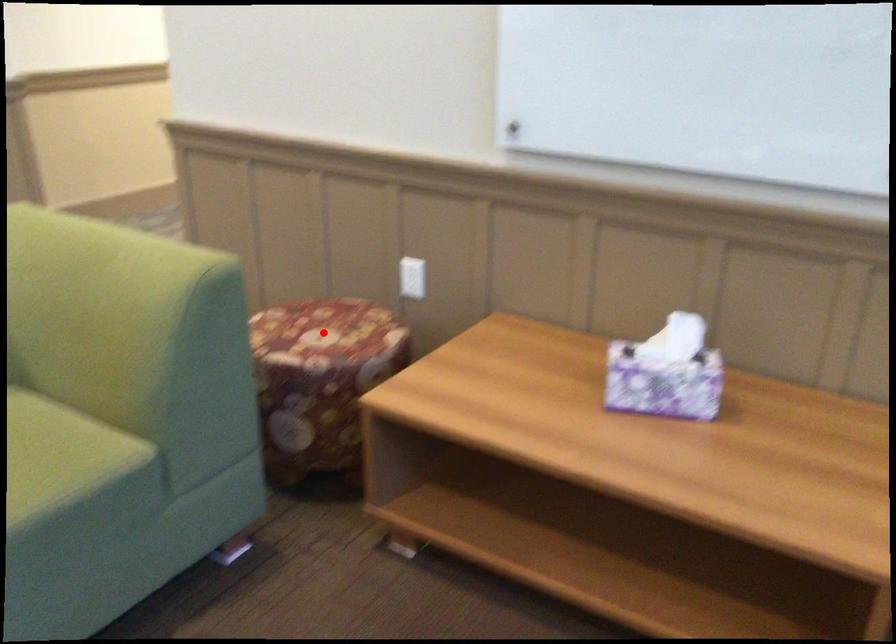
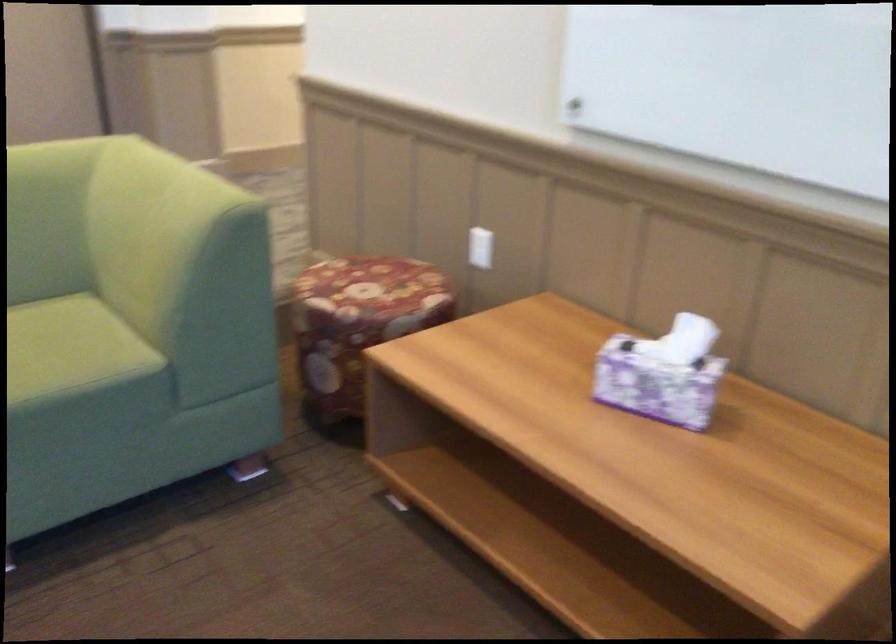
Where in the second image is the point corresponding to the highlighted location from the first image?

(372, 286)